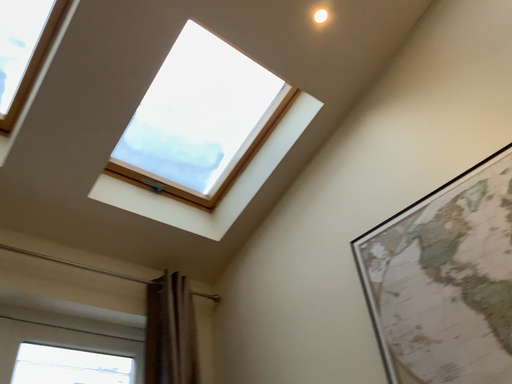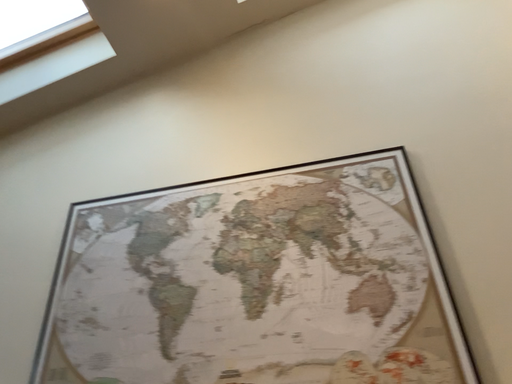
Question: How did the camera likely rotate when shooting the video?

Choices:
 (A) rotated upward
 (B) rotated downward

Answer: (B)